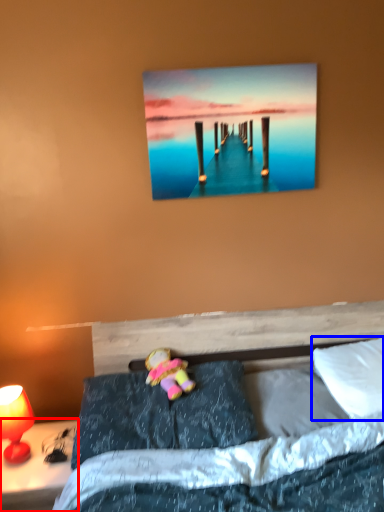
Question: Among these objects, which one is nearest to the camera, nightstand (highlighted by a red box) or pillow (highlighted by a blue box)?

Choices:
 (A) nightstand
 (B) pillow

Answer: (A)